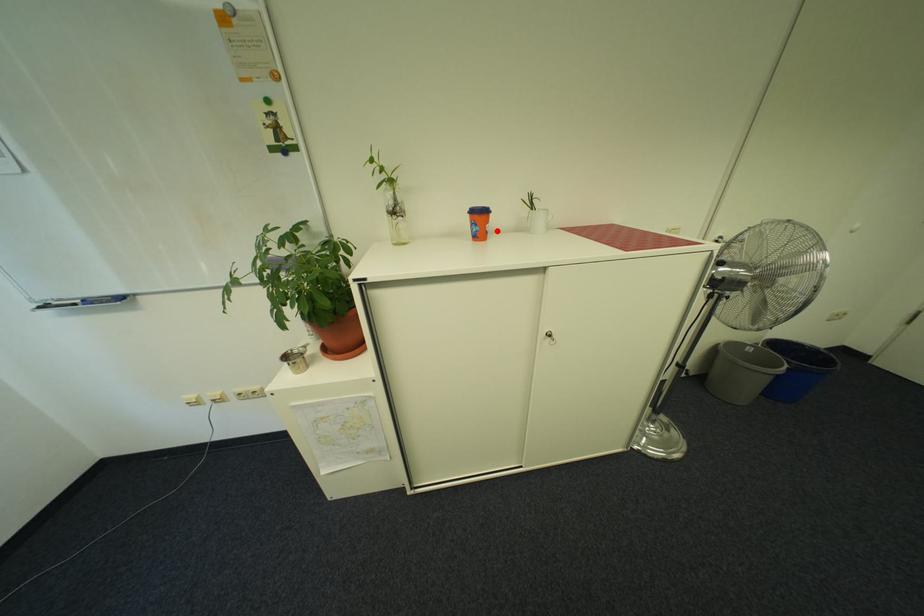
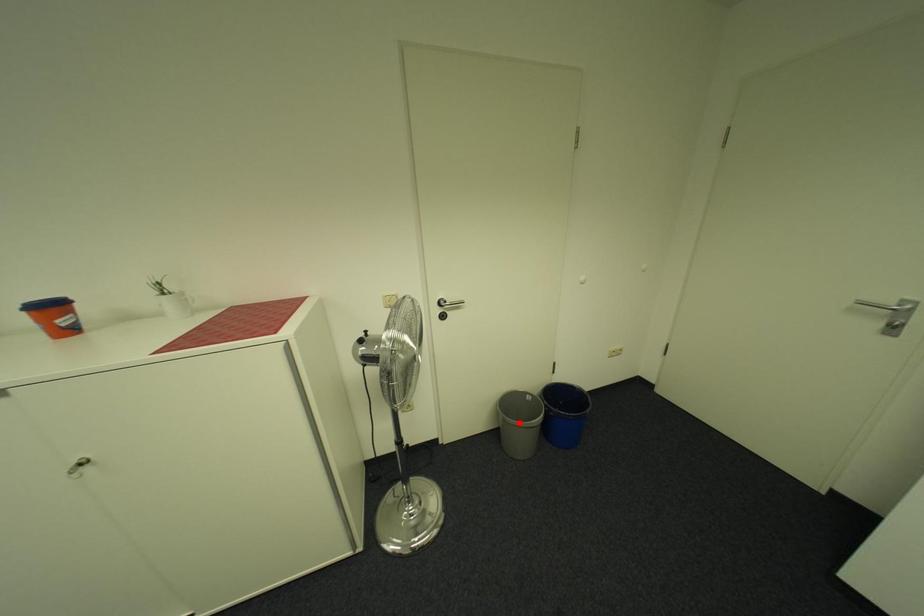
I am providing you with two images of the same scene from different viewpoints. A red point is marked on the first image and another point is marked on the second image. Is the red point in image1 aligned with the point shown in image2?

No